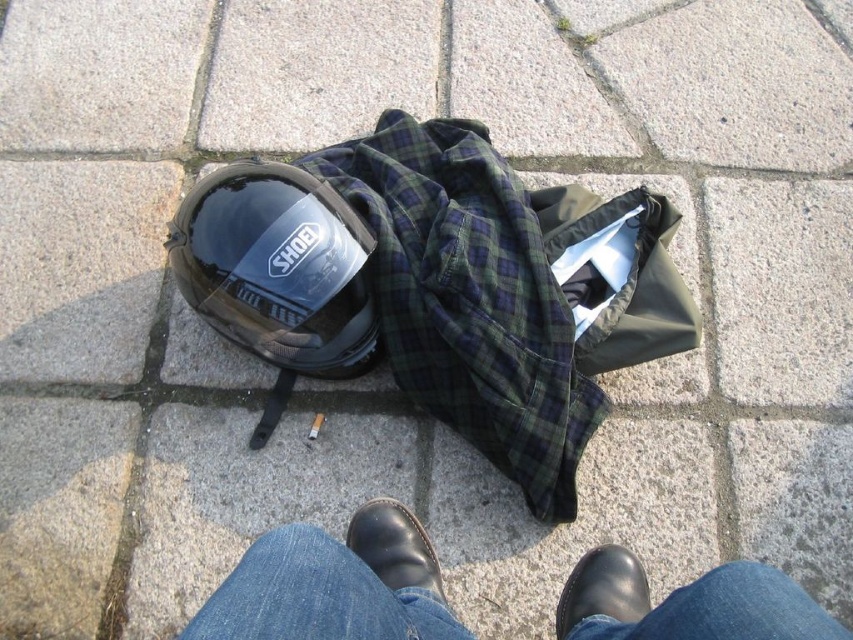
Question: Is jeans at lower center behind black leather shoe at center?

Choices:
 (A) yes
 (B) no

Answer: (B)

Question: Which object is the farthest from the jeans at lower center?

Choices:
 (A) green plaid shirt at center
 (B) glossy black helmet at center
 (C) black leather shoe at center
 (D) black leather shoe at lower center

Answer: (B)

Question: Does green plaid shirt at center have a larger size compared to jeans at lower center?

Choices:
 (A) yes
 (B) no

Answer: (A)

Question: Is green plaid shirt at center to the left of jeans at lower center from the viewer's perspective?

Choices:
 (A) no
 (B) yes

Answer: (B)

Question: Which of the following is the farthest from the observer?

Choices:
 (A) jeans at lower center
 (B) black leather shoe at lower center
 (C) green plaid shirt at center

Answer: (C)

Question: Which of these objects is positioned closest to the green plaid shirt at center?

Choices:
 (A) jeans at lower center
 (B) black leather shoe at lower center
 (C) black leather shoe at center

Answer: (C)